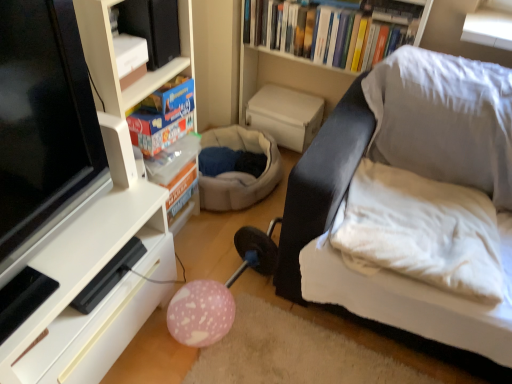
Question: Can you confirm if black leather couch at right is bigger than pink matte balloon at lower center?

Choices:
 (A) no
 (B) yes

Answer: (B)

Question: Does black leather couch at right turn towards pink matte balloon at lower center?

Choices:
 (A) no
 (B) yes

Answer: (A)

Question: Is black leather couch at right at the left side of pink matte balloon at lower center?

Choices:
 (A) yes
 (B) no

Answer: (B)

Question: Is black leather couch at right positioned before pink matte balloon at lower center?

Choices:
 (A) no
 (B) yes

Answer: (B)

Question: From the image's perspective, would you say black leather couch at right is positioned over pink matte balloon at lower center?

Choices:
 (A) yes
 (B) no

Answer: (A)

Question: From a real-world perspective, is black leather couch at right under pink matte balloon at lower center?

Choices:
 (A) no
 (B) yes

Answer: (A)

Question: Is white glossy shelf at lower left, the first shelf in the bottom-to-top sequence, surrounded by blue cardboard box at upper left, the 2th book from the back?

Choices:
 (A) no
 (B) yes

Answer: (A)

Question: Is blue cardboard box at upper left, marked as the 2th book in a top-to-bottom arrangement, taller than white glossy shelf at lower left, the first shelf in the bottom-to-top sequence?

Choices:
 (A) no
 (B) yes

Answer: (A)

Question: From the image's perspective, is blue cardboard box at upper left, marked as the 2th book in a top-to-bottom arrangement, below white glossy shelf at lower left, acting as the 2th shelf starting from the top?

Choices:
 (A) no
 (B) yes

Answer: (A)

Question: Does blue cardboard box at upper left, which appears as the first book when viewed from the front, have a larger size compared to white glossy shelf at lower left, acting as the 2th shelf starting from the top?

Choices:
 (A) no
 (B) yes

Answer: (A)

Question: Considering the relative positions of blue cardboard box at upper left, which is counted as the 2th book, starting from the right, and white glossy shelf at lower left, the first shelf in the bottom-to-top sequence, in the image provided, is blue cardboard box at upper left, which is counted as the 2th book, starting from the right, to the right of white glossy shelf at lower left, the first shelf in the bottom-to-top sequence, from the viewer's perspective?

Choices:
 (A) yes
 (B) no

Answer: (A)

Question: From a real-world perspective, is blue cardboard box at upper left, marked as the 2th book in a top-to-bottom arrangement, on white glossy shelf at lower left, the first shelf in the bottom-to-top sequence?

Choices:
 (A) yes
 (B) no

Answer: (A)

Question: Does white matte shelf at left, placed as the second shelf when sorted from bottom to top, have a larger size compared to blue cardboard box at upper left, which ranks as the 1th book in bottom-to-top order?

Choices:
 (A) yes
 (B) no

Answer: (A)